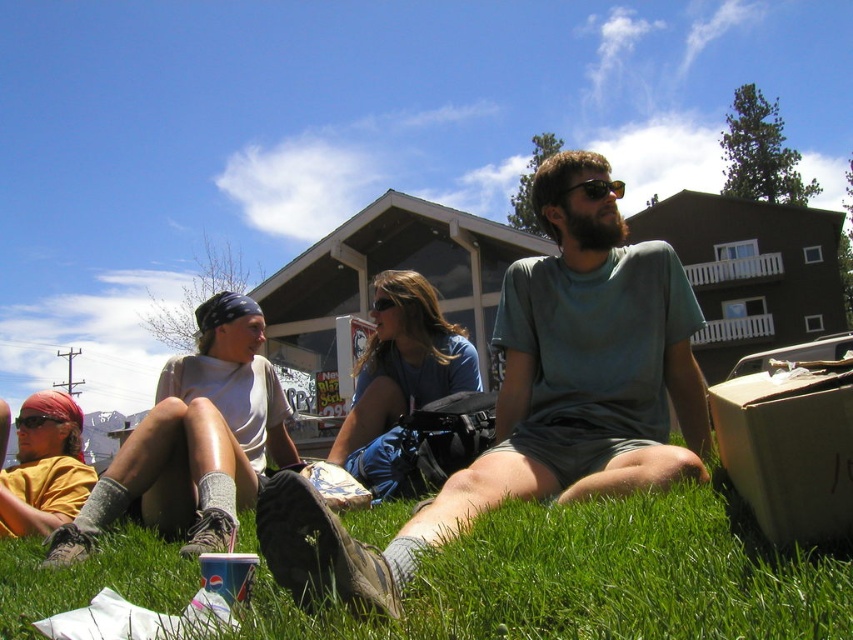
Between point (495, 465) and point (32, 420), which one is positioned behind?

The point (32, 420) is more distant.

Who is more forward, (305, 547) or (19, 420)?

Point (305, 547) is in front.

Between point (299, 561) and point (16, 420), which one is positioned behind?

The point (16, 420) is more distant.

Locate an element on the screen. Image resolution: width=853 pixels, height=640 pixels. gray cotton t-shirt at center is located at coordinates (537, 400).

Does green grass at lower center have a greater height compared to gray cotton t-shirt at center?

No, green grass at lower center is not taller than gray cotton t-shirt at center.

Image resolution: width=853 pixels, height=640 pixels. Describe the element at coordinates (601, 579) in the screenshot. I see `green grass at lower center` at that location.

Describe the element at coordinates (601, 579) in the screenshot. The height and width of the screenshot is (640, 853). I see `green grass at lower center` at that location.

Where is `green grass at lower center`? The width and height of the screenshot is (853, 640). green grass at lower center is located at coordinates (601, 579).

Is green grass at lower center shorter than matte black goggles at center?

No.

Is green grass at lower center wider than matte black goggles at center?

Yes, green grass at lower center is wider than matte black goggles at center.

Which is in front, point (254, 548) or point (35, 426)?

Positioned in front is point (254, 548).

The height and width of the screenshot is (640, 853). Find the location of `green grass at lower center`. green grass at lower center is located at coordinates (601, 579).